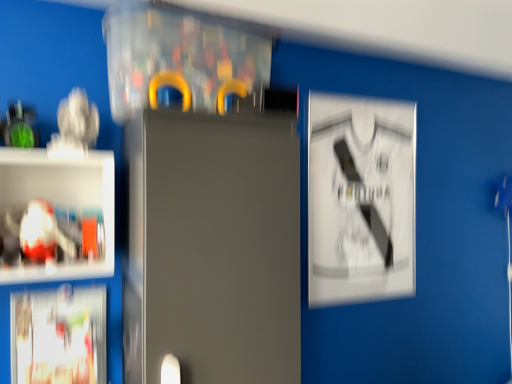
Question: Considering the positions of point (135, 94) and point (373, 244), is point (135, 94) closer or farther from the camera than point (373, 244)?

Choices:
 (A) closer
 (B) farther

Answer: (A)

Question: From a real-world perspective, is transparent plastic cabinet at upper center above or below white paper at upper right, which is counted as the first poster, starting from the right?

Choices:
 (A) below
 (B) above

Answer: (B)

Question: Estimate the real-world distances between objects in this image. Which object is closer to the satin gray fridge at center?

Choices:
 (A) translucent plastic shelf at left
 (B) transparent plastic cabinet at upper center
 (C) white paper at upper right, the 2th poster from the left
 (D) white glossy poster at lower left, the first poster positioned from the bottom

Answer: (B)

Question: Estimate the real-world distances between objects in this image. Which object is closer to the translucent plastic shelf at left?

Choices:
 (A) satin gray fridge at center
 (B) white paper at upper right, the 1th poster when ordered from back to front
 (C) white glossy poster at lower left, which is counted as the 2th poster, starting from the right
 (D) transparent plastic cabinet at upper center

Answer: (C)